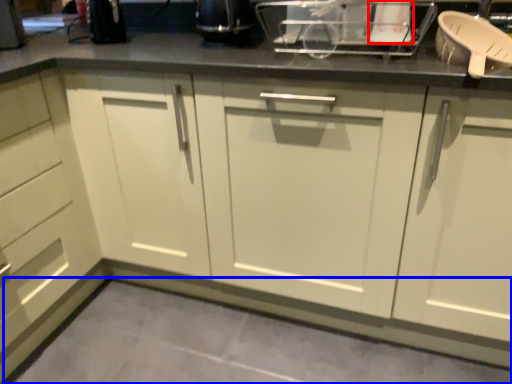
Question: Among these objects, which one is nearest to the camera, appliance (highlighted by a red box) or concrete (highlighted by a blue box)?

Choices:
 (A) appliance
 (B) concrete

Answer: (B)